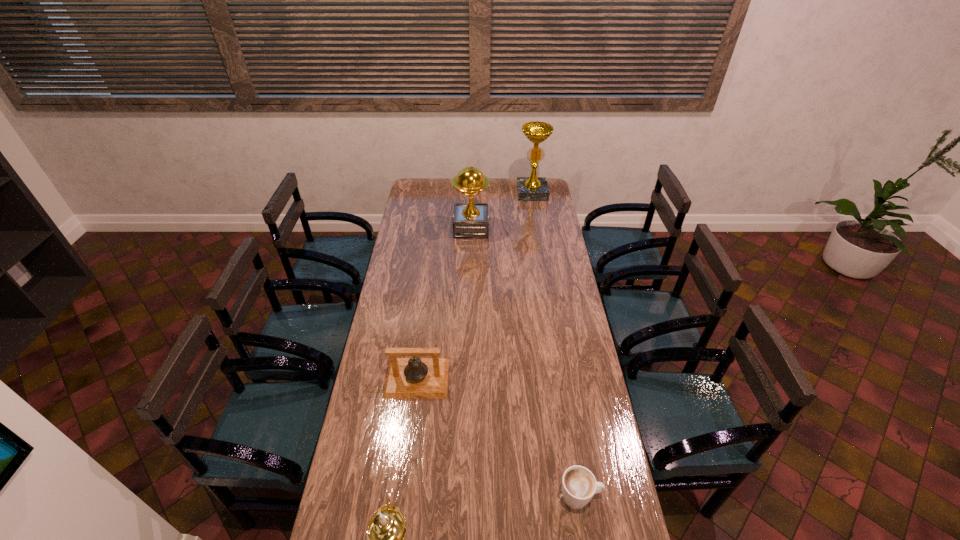
Locate an element on the screen. The image size is (960, 540). free space located with the handle on the side of the shortest object is located at coordinates (620, 496).

Identify the location of object present at the far edge. tap(533, 188).

At what (x,y) coordinates should I click in order to perform the action: click on object that is positioned at the left edge. Please return your answer as a coordinate pair (x, y). Looking at the image, I should click on (407, 378).

Locate an element on the screen. This screenshot has width=960, height=540. award that is positioned at the right edge is located at coordinates (533, 188).

Where is `cappuccino present at the right edge`? This screenshot has height=540, width=960. cappuccino present at the right edge is located at coordinates (579, 485).

You are a GUI agent. You are given a task and a screenshot of the screen. Output one action in this format:
    pyautogui.click(x=<x>, y=<y>)
    Task: Click on the object that is at the far right corner
    
    Given the screenshot: What is the action you would take?
    pyautogui.click(x=533, y=188)

This screenshot has height=540, width=960. Identify the location of vacant region at the far edge. click(488, 194).

Image resolution: width=960 pixels, height=540 pixels. In the image, there is a desktop. What are the coordinates of `vacant space at the left edge` in the screenshot? It's located at (389, 434).

Find the location of `vacant region at the right edge of the desktop`. vacant region at the right edge of the desktop is located at coordinates (546, 215).

Find the location of a particular element. The image size is (960, 540). free spot at the far left corner of the desktop is located at coordinates (414, 181).